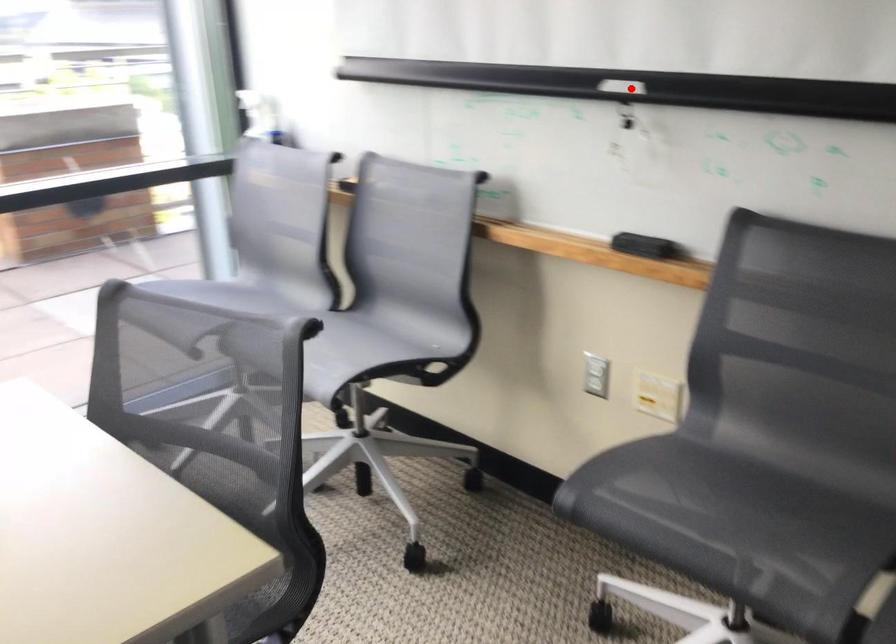
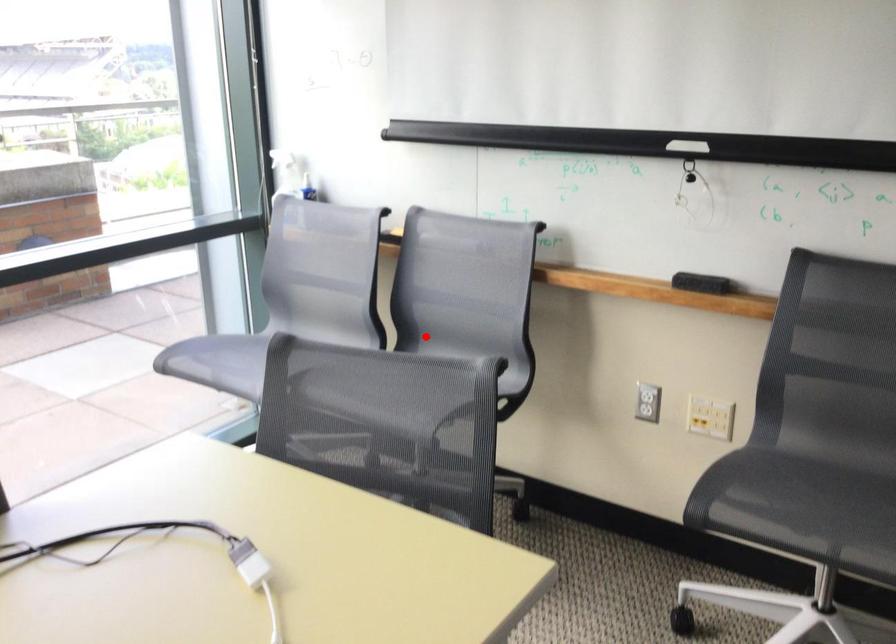
I am providing you with two images of the same scene from different viewpoints. A red point is marked on the first image and another point is marked on the second image. Is the red point in image1 aligned with the point shown in image2?

No